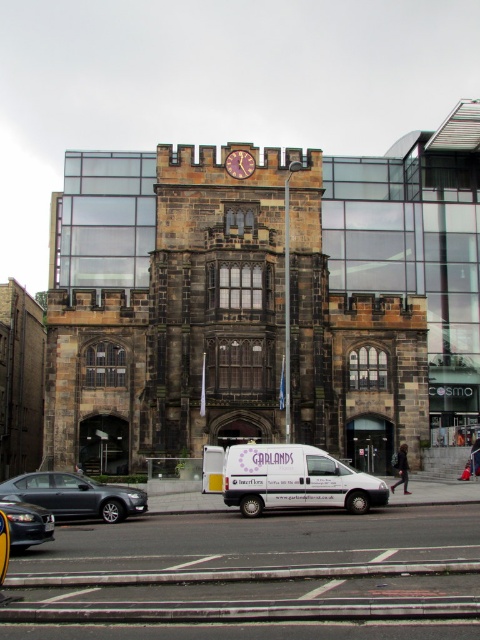
You are a pedestrian standing at the entrance of the large dark stone building. You see a metallic gray sedan at lower left and a shiny black car at lower left. Which car is closer to the entrance?

The metallic gray sedan at lower left is closer to the entrance because it is located below the shiny black car at lower left, meaning it is positioned lower in the image and thus nearer to the entrance.

You are a delivery driver with a truck that requires a 15 meter turning radius. You need to maneuver your truck from the shiny black car at lower left to the white matte van at center. Is there enough space to make the turn?

The distance between the white matte van at center and the shiny black car at lower left is 16.28 meters. Since your truck requires a 15 meter turning radius, there is sufficient space to make the turn as the distance exceeds the required radius.